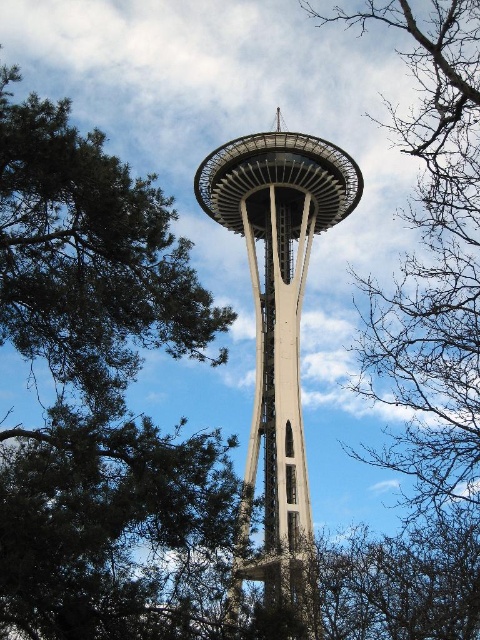
Question: Which of the following is the farthest from the observer?

Choices:
 (A) (443, 179)
 (B) (228, 227)

Answer: (B)

Question: Which of the following is the farthest from the observer?

Choices:
 (A) (105, 221)
 (B) (427, 24)
 (C) (283, 221)

Answer: (B)

Question: Can you confirm if green leafy tree at upper left is positioned below concrete tower at center?

Choices:
 (A) yes
 (B) no

Answer: (B)

Question: Is the position of green leafy tree at upper left less distant than that of concrete tower at center?

Choices:
 (A) no
 (B) yes

Answer: (A)

Question: Estimate the real-world distances between objects in this image. Which object is farther from the green leafy tree at upper left?

Choices:
 (A) bare branches at center
 (B) concrete tower at center

Answer: (A)

Question: Can you confirm if bare branches at center is smaller than concrete tower at center?

Choices:
 (A) no
 (B) yes

Answer: (A)